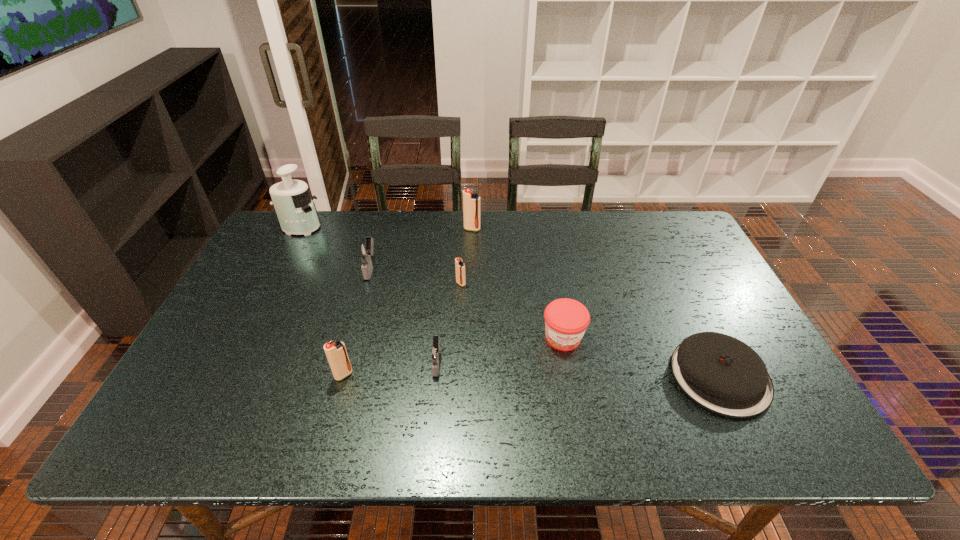
What are the coordinates of `vacant space at the far edge of the desktop` in the screenshot? It's located at (446, 223).

I want to click on vacant region at the near edge of the desktop, so click(x=577, y=448).

The width and height of the screenshot is (960, 540). What are the coordinates of `free space at the left edge of the desktop` in the screenshot? It's located at (300, 258).

I want to click on vacant space at the right edge of the desktop, so click(746, 336).

At what (x,y) coordinates should I click in order to perform the action: click on free location at the far right corner. Please return your answer as a coordinate pair (x, y). The width and height of the screenshot is (960, 540). Looking at the image, I should click on (x=667, y=218).

This screenshot has height=540, width=960. Find the location of `empty space that is in between the shortest object and the farthest igniter`. empty space that is in between the shortest object and the farthest igniter is located at coordinates (596, 303).

Locate an element on the screen. Image resolution: width=960 pixels, height=540 pixels. vacant region between the bigger gray igniter and the jam is located at coordinates (467, 303).

Locate an element on the screen. vacant area that lies between the seventh shortest object and the leftmost red igniter is located at coordinates (408, 302).

Locate an element on the screen. Image resolution: width=960 pixels, height=540 pixels. unoccupied position between the left gray igniter and the smallest red igniter is located at coordinates (416, 275).

Find the location of a particular element. free spot between the smallest red igniter and the farther gray igniter is located at coordinates (416, 275).